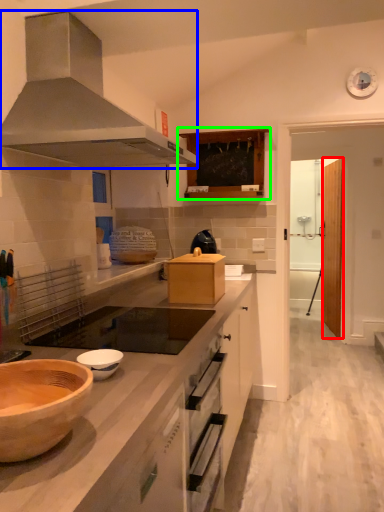
Question: Estimate the real-world distances between objects in this image. Which object is farther from glass door (highlighted by a red box), kitchen appliance (highlighted by a blue box) or cabinetry (highlighted by a green box)?

Choices:
 (A) kitchen appliance
 (B) cabinetry

Answer: (A)